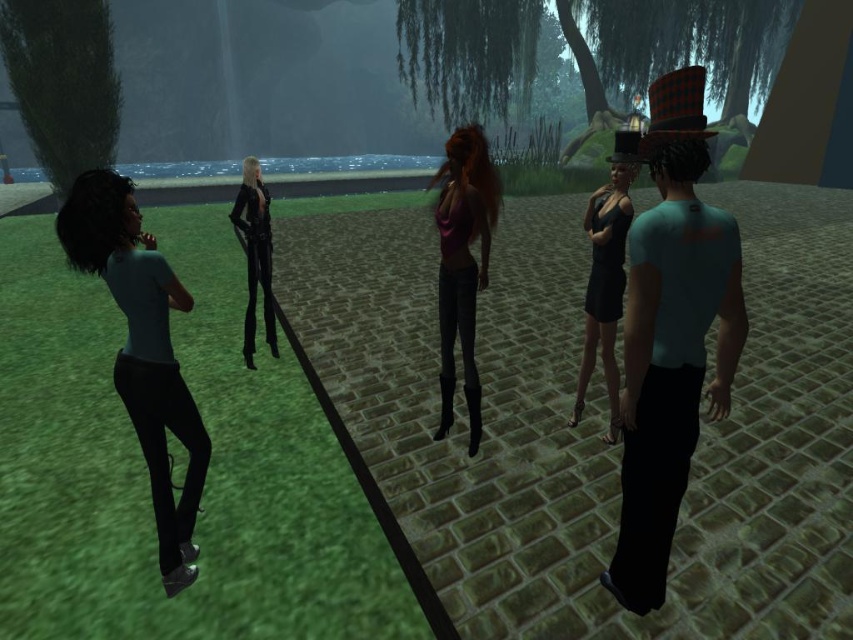
Which of these two, matte blue shirt at left or shiny purple top at center, stands taller?

matte blue shirt at left is taller.

Who is more distant from viewer, [132,416] or [454,141]?

The point [454,141] is behind.

Locate an element on the screen. This screenshot has width=853, height=640. matte blue shirt at left is located at coordinates (142, 352).

Which is in front, point (461, 154) or point (273, 332)?

Point (461, 154) is more forward.

The width and height of the screenshot is (853, 640). What do you see at coordinates (462, 262) in the screenshot?
I see `shiny purple top at center` at bounding box center [462, 262].

Measure the distance between point [471,353] and camera.

Point [471,353] is 4.20 meters from camera.

Where is `shiny purple top at center`? The height and width of the screenshot is (640, 853). shiny purple top at center is located at coordinates (462, 262).

Measure the distance between shiny purple top at center and shiny black dress at center.

They are 1.21 meters apart.

Can you confirm if shiny purple top at center is taller than shiny black dress at center?

In fact, shiny purple top at center may be shorter than shiny black dress at center.

Locate an element on the screen. The width and height of the screenshot is (853, 640). shiny purple top at center is located at coordinates (462, 262).